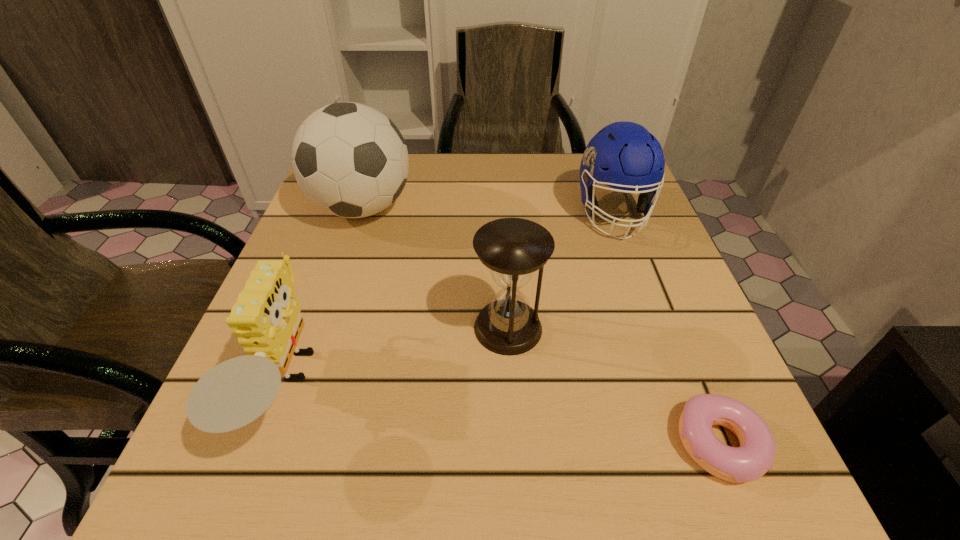
Where is `object positioned at the far right corner`? object positioned at the far right corner is located at coordinates (623, 155).

What are the coordinates of `object at the near right corner` in the screenshot? It's located at (755, 456).

This screenshot has width=960, height=540. What are the coordinates of `vacant area at the far edge of the desktop` in the screenshot? It's located at (420, 178).

In the image, there is a desktop. Identify the location of vacant space at the near edge. (592, 461).

The width and height of the screenshot is (960, 540). In order to click on free region at the left edge of the desktop in this screenshot , I will do `click(315, 286)`.

This screenshot has width=960, height=540. In the image, there is a desktop. Identify the location of free space at the right edge. (656, 232).

Locate an element on the screen. free space between the sponge and the football helmet is located at coordinates (449, 300).

Identify the location of free spot between the doughnut and the football helmet. This screenshot has height=540, width=960. (666, 329).

The image size is (960, 540). What are the coordinates of `free point between the shortest object and the football helmet` in the screenshot? It's located at (666, 329).

Locate an element on the screen. The height and width of the screenshot is (540, 960). free spot between the sponge and the tallest object is located at coordinates (324, 298).